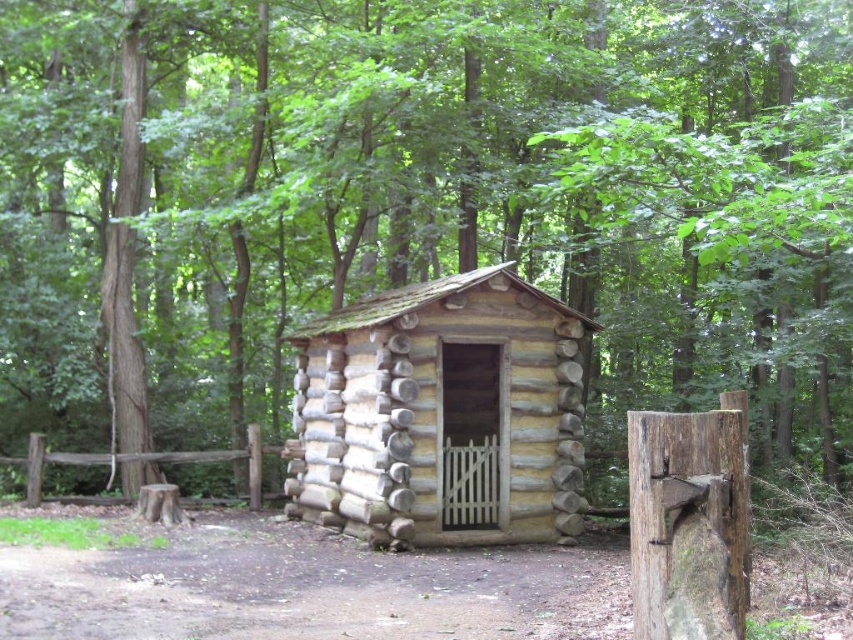
Question: Among these objects, which one is farthest from the camera?

Choices:
 (A) light brown wooden log cabin at center
 (B) smooth brown log at center
 (C) brown wooden fence at lower left

Answer: (C)

Question: Does light brown wooden log cabin at center come in front of smooth brown log at center?

Choices:
 (A) no
 (B) yes

Answer: (A)

Question: Is light brown wooden log cabin at center above brown wooden fence at lower left?

Choices:
 (A) no
 (B) yes

Answer: (B)

Question: Among these objects, which one is nearest to the camera?

Choices:
 (A) brown wooden fence at lower left
 (B) light brown wooden log cabin at center
 (C) smooth brown log at center

Answer: (C)

Question: Does light brown wooden log cabin at center appear under smooth brown log at center?

Choices:
 (A) no
 (B) yes

Answer: (B)

Question: Among these objects, which one is farthest from the camera?

Choices:
 (A) smooth brown log at center
 (B) light brown wooden log cabin at center

Answer: (B)